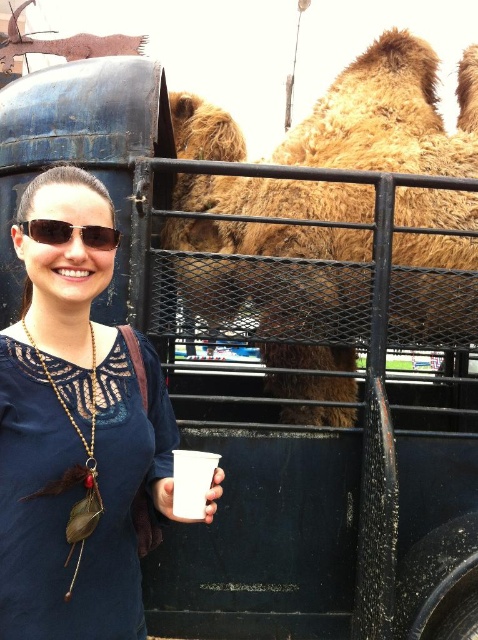
You are a photographer taking a picture of the woman in the scene. You notice the white paper cup at lower left and the matte black sunglasses at center. Which object should you focus on first to ensure it appears sharp in the photo?

The white paper cup at lower left is closer to the viewer than the matte black sunglasses at center, so you should focus on the white paper cup at lower left first to ensure it appears sharp in the photo.

You are a photographer trying to capture a closeup of the matte black sunglasses at center while also including the fuzzy brown camel at upper right in the frame. Given their sizes, will the camel appear larger or smaller than the sunglasses in the photo?

The fuzzy brown camel at upper right is wider than the matte black sunglasses at center, so in the photo, the camel will appear larger than the sunglasses.